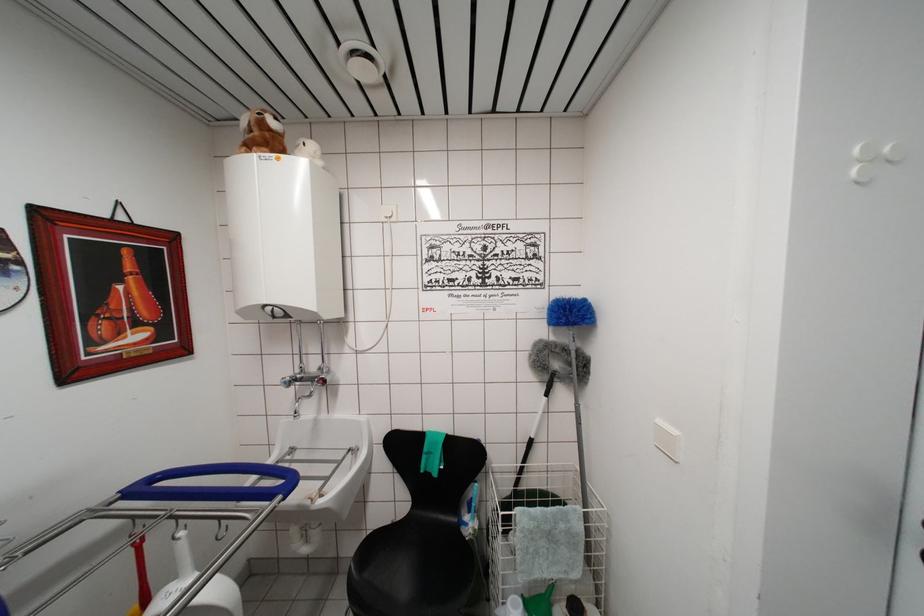
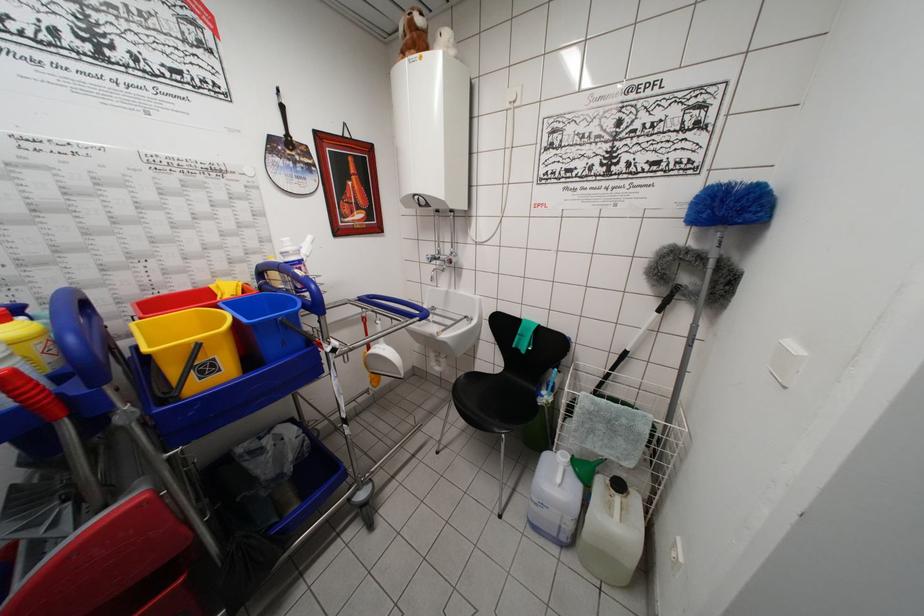
In the second image, find the point that corresponds to (530,446) in the first image.

(624, 358)